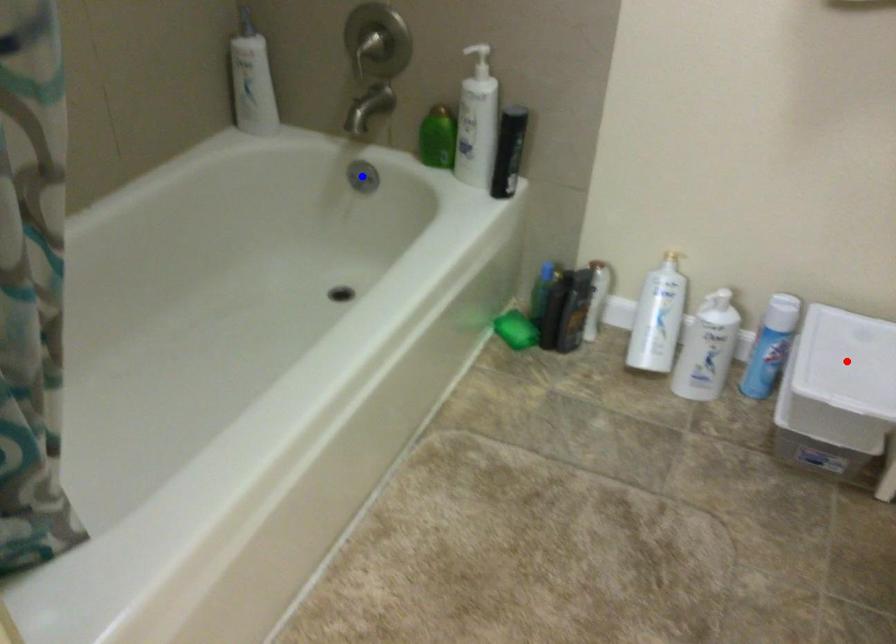
Question: Which of the two points in the image is closer to the camera?

Choices:
 (A) Blue point is closer.
 (B) Red point is closer.

Answer: (B)